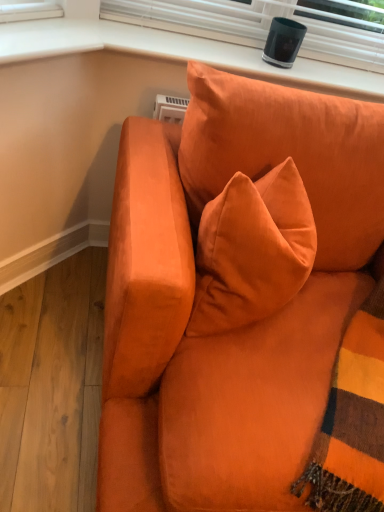
The height and width of the screenshot is (512, 384). Describe the element at coordinates (244, 302) in the screenshot. I see `matte orange couch at center` at that location.

Locate an element on the screen. Image resolution: width=384 pixels, height=512 pixels. matte orange couch at center is located at coordinates (244, 302).

Describe the element at coordinates (176, 53) in the screenshot. I see `matte black speaker at upper center` at that location.

This screenshot has width=384, height=512. In order to click on matte black speaker at upper center in this screenshot , I will do `click(176, 53)`.

This screenshot has width=384, height=512. I want to click on matte orange couch at center, so click(x=244, y=302).

Between matte black speaker at upper center and matte orange couch at center, which one appears on the left side from the viewer's perspective?

From the viewer's perspective, matte black speaker at upper center appears more on the left side.

Does matte black speaker at upper center come behind matte orange couch at center?

Yes, it is behind matte orange couch at center.

Which is in front, point (137, 52) or point (148, 180)?

The point (148, 180) is more forward.

In the scene shown: From the image's perspective, which one is positioned higher, matte black speaker at upper center or matte orange couch at center?

matte black speaker at upper center is shown above in the image.

From a real-world perspective, is matte black speaker at upper center physically below matte orange couch at center?

No, from a real-world perspective, matte black speaker at upper center is not below matte orange couch at center.

Is matte black speaker at upper center wider than matte orange couch at center?

In fact, matte black speaker at upper center might be narrower than matte orange couch at center.

Who is shorter, matte black speaker at upper center or matte orange couch at center?

With less height is matte black speaker at upper center.

Is matte black speaker at upper center bigger than matte orange couch at center?

Incorrect, matte black speaker at upper center is not larger than matte orange couch at center.

Would you say matte black speaker at upper center is inside or outside matte orange couch at center?

matte black speaker at upper center exists outside the volume of matte orange couch at center.

Is matte black speaker at upper center next to matte orange couch at center?

There is a gap between matte black speaker at upper center and matte orange couch at center.

Is matte black speaker at upper center positioned with its back to matte orange couch at center?

That's not correct — matte black speaker at upper center is not looking away from matte orange couch at center.

How many degrees apart are the facing directions of matte black speaker at upper center and matte orange couch at center?

matte black speaker at upper center and matte orange couch at center are facing 0.971 degrees away from each other.

Locate an element on the screen. Image resolution: width=384 pixels, height=512 pixels. window sill that appears above the matte orange couch at center (from the image's perspective) is located at coordinates (176, 53).

Can you confirm if matte orange couch at center is positioned to the left of matte black speaker at upper center?

No, matte orange couch at center is not to the left of matte black speaker at upper center.

Is the position of matte orange couch at center more distant than that of matte black speaker at upper center?

No, matte orange couch at center is closer to the camera.

Between point (308, 386) and point (261, 69), which one is positioned in front?

The point (308, 386) is closer.

From the image's perspective, is matte orange couch at center below matte black speaker at upper center?

Correct, matte orange couch at center appears lower than matte black speaker at upper center in the image.

From a real-world perspective, is matte orange couch at center positioned under matte black speaker at upper center based on gravity?

Yes, from a real-world perspective, matte orange couch at center is beneath matte black speaker at upper center.

Which of these two, matte orange couch at center or matte black speaker at upper center, is thinner?

matte black speaker at upper center.

Considering the sizes of objects matte orange couch at center and matte black speaker at upper center in the image provided, who is taller, matte orange couch at center or matte black speaker at upper center?

matte orange couch at center.

Who is bigger, matte orange couch at center or matte black speaker at upper center?

matte orange couch at center is bigger.

Could matte black speaker at upper center be considered to be inside matte orange couch at center?

No, matte orange couch at center does not contain matte black speaker at upper center.

Consider the image. Is matte orange couch at center next to matte black speaker at upper center?

No, matte orange couch at center is not next to matte black speaker at upper center.

Is matte orange couch at center positioned with its back to matte black speaker at upper center?

Yes, matte orange couch at center's orientation is away from matte black speaker at upper center.

How different are the orientations of matte orange couch at center and matte black speaker at upper center in degrees?

The angle between the facing direction of matte orange couch at center and the facing direction of matte black speaker at upper center is 0.971 degrees.

Where is `studio couch below the matte black speaker at upper center (from the image's perspective)`? studio couch below the matte black speaker at upper center (from the image's perspective) is located at coordinates (244, 302).

Image resolution: width=384 pixels, height=512 pixels. Identify the location of studio couch below the matte black speaker at upper center (from the image's perspective). (244, 302).

This screenshot has width=384, height=512. Find the location of `studio couch that appears below the matte black speaker at upper center (from a real-world perspective)`. studio couch that appears below the matte black speaker at upper center (from a real-world perspective) is located at coordinates (244, 302).